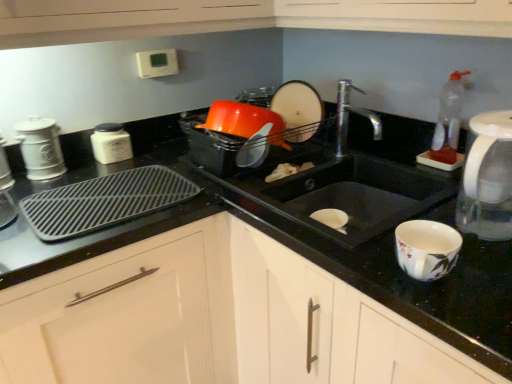
Locate an element on the screen. Image resolution: width=512 pixels, height=384 pixels. black plastic tray at left is located at coordinates (104, 202).

In order to face black plastic tray at left, should I rotate leftwards or rightwards?

You should look left and rotate roughly 18.596 degrees.

The width and height of the screenshot is (512, 384). What do you see at coordinates (298, 110) in the screenshot?
I see `matte white plate at upper center, which is the 5th appliance in left-to-right order` at bounding box center [298, 110].

What do you see at coordinates (111, 143) in the screenshot? This screenshot has width=512, height=384. I see `white matte jar at left, acting as the 3th appliance starting from the left` at bounding box center [111, 143].

What is the approximate height of white matte jar at left, positioned as the third appliance in right-to-left order?

The height of white matte jar at left, positioned as the third appliance in right-to-left order, is 5.24 inches.

Measure the distance between point (21, 135) and camera.

The depth of point (21, 135) is 4.40 feet.

The height and width of the screenshot is (384, 512). What do you see at coordinates (4, 169) in the screenshot?
I see `white matte canister at left, which appears as the 1th appliance when viewed from the left` at bounding box center [4, 169].

At what (x,y) coordinates should I click in order to perform the action: click on white plastic microwave at upper center, acting as the 4th appliance starting from the left. Please return your answer as a coordinate pair (x, y). Image resolution: width=512 pixels, height=384 pixels. Looking at the image, I should click on (157, 63).

This screenshot has width=512, height=384. What do you see at coordinates (319, 163) in the screenshot? I see `black matte sink at center` at bounding box center [319, 163].

At what (x,y) coordinates should I click in order to perform the action: click on black plastic tray at left. Please return your answer as a coordinate pair (x, y). The width and height of the screenshot is (512, 384). Looking at the image, I should click on (104, 202).

What's the angular difference between white plastic microwave at upper center, the 2th appliance when ordered from right to left, and white matte cabinet at center's facing directions?

white plastic microwave at upper center, the 2th appliance when ordered from right to left, and white matte cabinet at center are facing 87.6 degrees away from each other.

Does white plastic microwave at upper center, acting as the 4th appliance starting from the left, have a lesser height compared to white matte cabinet at center?

Indeed, white plastic microwave at upper center, acting as the 4th appliance starting from the left, has a lesser height compared to white matte cabinet at center.

From the image's perspective, is white plastic microwave at upper center, acting as the 4th appliance starting from the left, above white matte cabinet at center?

Yes, from the image's perspective, white plastic microwave at upper center, acting as the 4th appliance starting from the left, is above white matte cabinet at center.

Considering the relative sizes of white plastic microwave at upper center, acting as the 4th appliance starting from the left, and white matte cabinet at center in the image provided, is white plastic microwave at upper center, acting as the 4th appliance starting from the left, thinner than white matte cabinet at center?

Yes.

Looking at this image, which of these two, white matte cabinet at center or matte white plate at upper center, which is the 5th appliance in left-to-right order, is smaller?

matte white plate at upper center, which is the 5th appliance in left-to-right order, is smaller.

Image resolution: width=512 pixels, height=384 pixels. In order to click on cabinetry below the matte white plate at upper center, which is the 5th appliance in left-to-right order (from the image's perspective) in this screenshot , I will do `click(214, 320)`.

Could you tell me if white matte cabinet at center is turned towards matte white plate at upper center, arranged as the 1th appliance when viewed from the right?

→ No, white matte cabinet at center does not turn towards matte white plate at upper center, arranged as the 1th appliance when viewed from the right.

Relative to matte white plate at upper center, arranged as the 1th appliance when viewed from the right, is white matte cabinet at center in front or behind?

white matte cabinet at center is positioned closer to the viewer than matte white plate at upper center, arranged as the 1th appliance when viewed from the right.

From the image's perspective, between white matte cabinet at center and black plastic tray at left, which one is located above?

black plastic tray at left appears higher in the image.

Based on the photo, between white matte cabinet at center and black plastic tray at left, which one appears on the left side from the viewer's perspective?

black plastic tray at left is more to the left.

Is white matte cabinet at center next to black plastic tray at left and touching it?

No.

From the picture: From a real-world perspective, is black plastic tray at left beneath white plastic microwave at upper center, acting as the 4th appliance starting from the left?

Yes, from a real-world perspective, black plastic tray at left is below white plastic microwave at upper center, acting as the 4th appliance starting from the left.

Is black plastic tray at left facing away from white plastic microwave at upper center, acting as the 4th appliance starting from the left?

No, white plastic microwave at upper center, acting as the 4th appliance starting from the left, is not at the back of black plastic tray at left.

Who is shorter, black plastic tray at left or white plastic microwave at upper center, the 2th appliance when ordered from right to left?

With less height is black plastic tray at left.

In terms of size, does black plastic tray at left appear bigger or smaller than white plastic microwave at upper center, acting as the 4th appliance starting from the left?

Clearly, black plastic tray at left is larger in size than white plastic microwave at upper center, acting as the 4th appliance starting from the left.

Where is `the 4th appliance to the left of the matte white plate at upper center, which is the 5th appliance in left-to-right order, starting your count from the anchor`? The width and height of the screenshot is (512, 384). the 4th appliance to the left of the matte white plate at upper center, which is the 5th appliance in left-to-right order, starting your count from the anchor is located at coordinates (4, 169).

Is matte white plate at upper center, arranged as the 1th appliance when viewed from the right, at the right side of white matte canister at left, which is the fifth appliance in right-to-left order?

Yes.

In terms of height, does matte white plate at upper center, arranged as the 1th appliance when viewed from the right, look taller or shorter compared to white matte canister at left, which appears as the 1th appliance when viewed from the left?

In the image, matte white plate at upper center, arranged as the 1th appliance when viewed from the right, appears to be taller than white matte canister at left, which appears as the 1th appliance when viewed from the left.

Is point (309, 118) farther from camera compared to point (93, 145)?

Yes, point (309, 118) is farther from viewer.

Looking at this image, who is smaller, matte white plate at upper center, arranged as the 1th appliance when viewed from the right, or white matte jar at left, acting as the 3th appliance starting from the left?

white matte jar at left, acting as the 3th appliance starting from the left, is smaller.

Which is more to the right, matte white plate at upper center, which is the 5th appliance in left-to-right order, or white matte jar at left, acting as the 3th appliance starting from the left?

Positioned to the right is matte white plate at upper center, which is the 5th appliance in left-to-right order.

Is matte white plate at upper center, arranged as the 1th appliance when viewed from the right, positioned with its back to white matte jar at left, acting as the 3th appliance starting from the left?

That's not correct — matte white plate at upper center, arranged as the 1th appliance when viewed from the right, is not looking away from white matte jar at left, acting as the 3th appliance starting from the left.

Which object is thinner, matte white plate at upper center, arranged as the 1th appliance when viewed from the right, or white ceramic canister at left, which ranks as the second appliance in left-to-right order?

matte white plate at upper center, arranged as the 1th appliance when viewed from the right, is thinner.

Is there a large distance between matte white plate at upper center, arranged as the 1th appliance when viewed from the right, and white ceramic canister at left, which ranks as the second appliance in left-to-right order?

That's not correct — matte white plate at upper center, arranged as the 1th appliance when viewed from the right, is a little close to white ceramic canister at left, which ranks as the second appliance in left-to-right order.

Is matte white plate at upper center, arranged as the 1th appliance when viewed from the right, aimed at white ceramic canister at left, which appears as the fourth appliance when viewed from the right?

Yes, matte white plate at upper center, arranged as the 1th appliance when viewed from the right, is turned towards white ceramic canister at left, which appears as the fourth appliance when viewed from the right.

Locate an element on the screen. This screenshot has width=512, height=384. cabinetry in front of the white plastic microwave at upper center, acting as the 4th appliance starting from the left is located at coordinates (214, 320).

Where is `the 1st appliance to the left of the white matte cabinet at center, starting your count from the anchor`? The image size is (512, 384). the 1st appliance to the left of the white matte cabinet at center, starting your count from the anchor is located at coordinates (298, 110).

Which object lies further to the anchor point black matte sink at center, white matte cabinet at center or black plastic tray at left?

Based on the image, black plastic tray at left appears to be further to black matte sink at center.

Based on their spatial positions, is white matte jar at left, acting as the 3th appliance starting from the left, or matte white plate at upper center, arranged as the 1th appliance when viewed from the right, closer to black matte sink at center?

matte white plate at upper center, arranged as the 1th appliance when viewed from the right, is positioned closer to the anchor black matte sink at center.

Based on their spatial positions, is white matte cabinet at center or white matte canister at left, which appears as the 1th appliance when viewed from the left, further from black matte sink at center?

Among the two, white matte canister at left, which appears as the 1th appliance when viewed from the left, is located further to black matte sink at center.

Which object lies nearer to the anchor point white matte jar at left, positioned as the third appliance in right-to-left order, white ceramic canister at left, which appears as the fourth appliance when viewed from the right, or matte white plate at upper center, arranged as the 1th appliance when viewed from the right?

white ceramic canister at left, which appears as the fourth appliance when viewed from the right, lies closer to white matte jar at left, positioned as the third appliance in right-to-left order, than the other object.

Looking at the image, which one is located closer to black matte sink at center, black plastic tray at left or matte white plate at upper center, which is the 5th appliance in left-to-right order?

Based on the image, matte white plate at upper center, which is the 5th appliance in left-to-right order, appears to be nearer to black matte sink at center.

Estimate the real-world distances between objects in this image. Which object is closer to black matte sink at center, black plastic tray at left or white plastic microwave at upper center, acting as the 4th appliance starting from the left?

black plastic tray at left.

Considering their positions, is matte white plate at upper center, which is the 5th appliance in left-to-right order, positioned further to white plastic microwave at upper center, acting as the 4th appliance starting from the left, than black matte sink at center?

The object further to white plastic microwave at upper center, acting as the 4th appliance starting from the left, is black matte sink at center.

Considering their positions, is matte white plate at upper center, which is the 5th appliance in left-to-right order, positioned further to white ceramic canister at left, which ranks as the second appliance in left-to-right order, than white matte cabinet at center?

matte white plate at upper center, which is the 5th appliance in left-to-right order, is positioned further to the anchor white ceramic canister at left, which ranks as the second appliance in left-to-right order.

Find the location of a particular element. The width and height of the screenshot is (512, 384). appliance between white matte canister at left, which is the fifth appliance in right-to-left order, and white matte jar at left, positioned as the third appliance in right-to-left order is located at coordinates (40, 148).

Where is `kitchen appliance between white matte jar at left, positioned as the third appliance in right-to-left order, and white matte cabinet at center, in the horizontal direction`? The height and width of the screenshot is (384, 512). kitchen appliance between white matte jar at left, positioned as the third appliance in right-to-left order, and white matte cabinet at center, in the horizontal direction is located at coordinates tap(104, 202).

The image size is (512, 384). What are the coordinates of `sink between white matte cabinet at center and white plastic microwave at upper center, acting as the 4th appliance starting from the left, along the z-axis` in the screenshot? It's located at (319, 163).

Locate an element on the screen. The image size is (512, 384). kitchen appliance located between white matte jar at left, acting as the 3th appliance starting from the left, and black matte sink at center in the left-right direction is located at coordinates (104, 202).